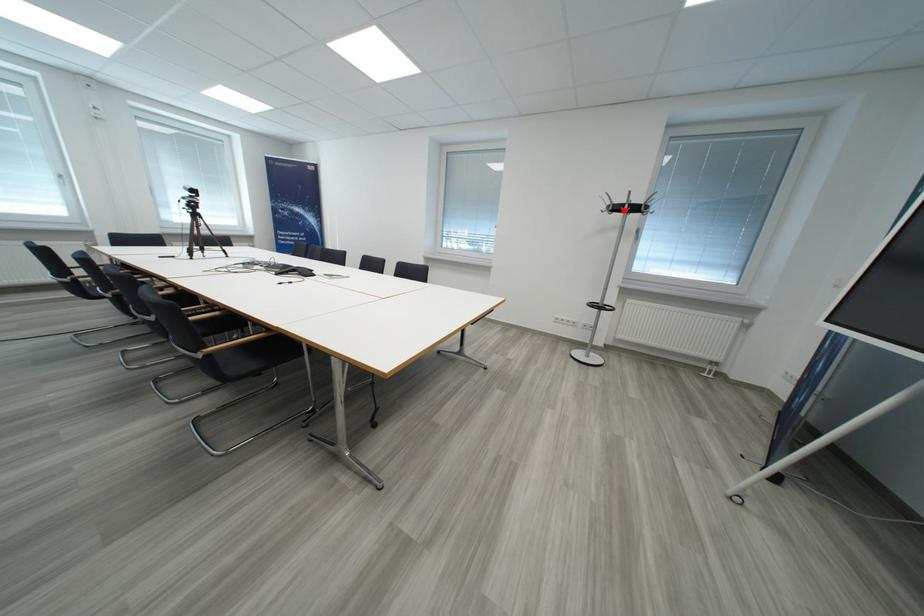
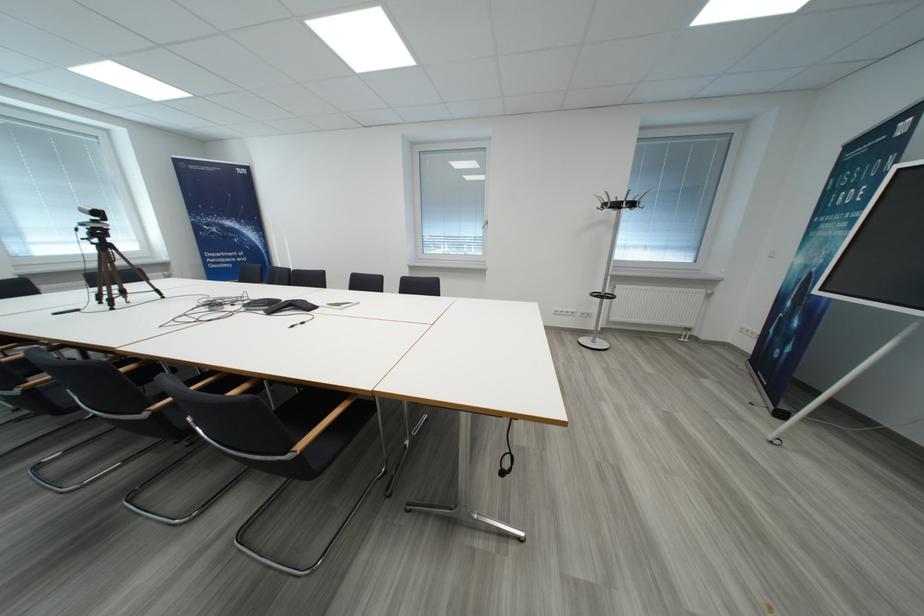
Question: I am providing you with two images of the same scene from different viewpoints. A red point is marked on the first image. Is the red point's position out of view in image 2?

Choices:
 (A) Yes
 (B) No

Answer: (B)